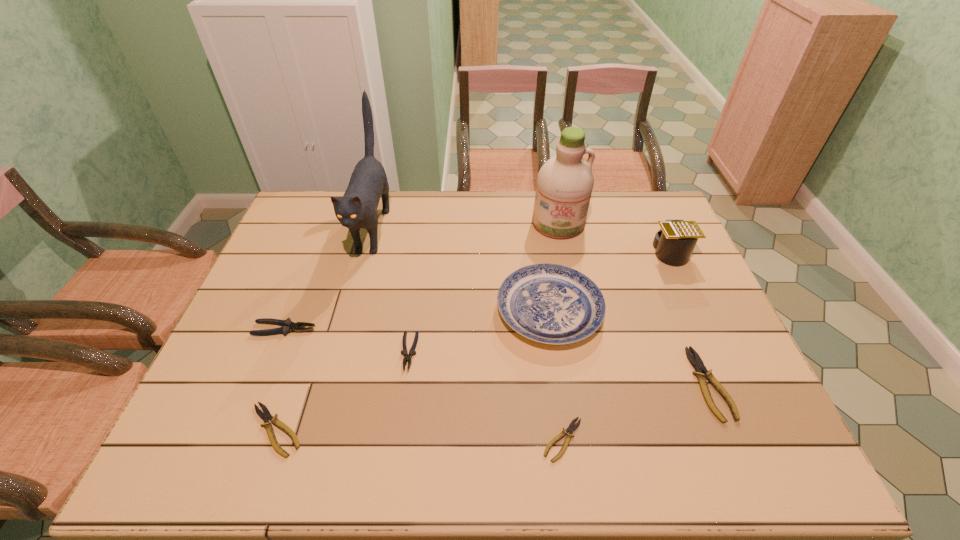
Where is `the smaller gray pliers`? The width and height of the screenshot is (960, 540). the smaller gray pliers is located at coordinates (407, 357).

At what (x,y) coordinates should I click in order to perform the action: click on the second shortest object. Please return your answer as a coordinate pair (x, y). The image size is (960, 540). Looking at the image, I should click on (265, 415).

At what (x,y) coordinates should I click in order to perform the action: click on the second shortest pliers. Please return your answer as a coordinate pair (x, y). Looking at the image, I should click on (265, 415).

This screenshot has width=960, height=540. What are the coordinates of `the shortest pliers` in the screenshot? It's located at (571, 428).

You are a GUI agent. You are given a task and a screenshot of the screen. Output one action in this format:
    pyautogui.click(x=<x>, y=<y>)
    Task: Click on the second yellow pliers from right to left
    Image resolution: width=960 pixels, height=540 pixels.
    Given the screenshot: What is the action you would take?
    pyautogui.click(x=571, y=428)

Where is `free space located at the face of the cat`? The height and width of the screenshot is (540, 960). free space located at the face of the cat is located at coordinates (344, 336).

Where is `vacant area located on the front label of the cleansing agent`? This screenshot has height=540, width=960. vacant area located on the front label of the cleansing agent is located at coordinates (575, 308).

This screenshot has width=960, height=540. Find the location of `vacant region located 0.230m on the back of the calculator`. vacant region located 0.230m on the back of the calculator is located at coordinates (645, 199).

This screenshot has width=960, height=540. What are the coordinates of `free space located on the back of the blue plate` in the screenshot? It's located at (534, 205).

The image size is (960, 540). In order to click on blank space located 0.400m at the gripping part of the fifth tallest object in this screenshot , I will do `click(461, 329)`.